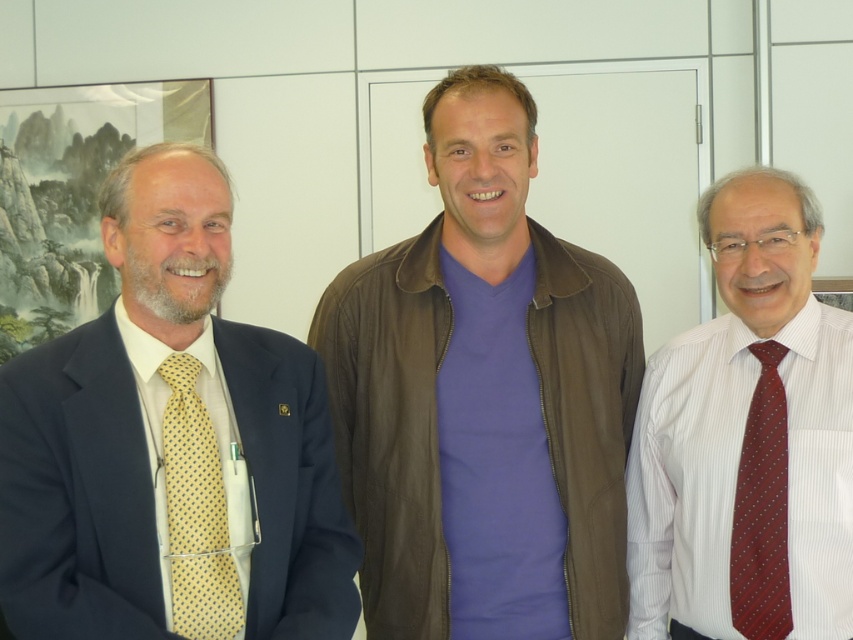
You are standing in a room with three people against a white wall. You need to locate the brown leather jacket at center and the matte yellow tie at left. Which one is positioned to the right of the other?

The brown leather jacket at center is to the right of the matte yellow tie at left.